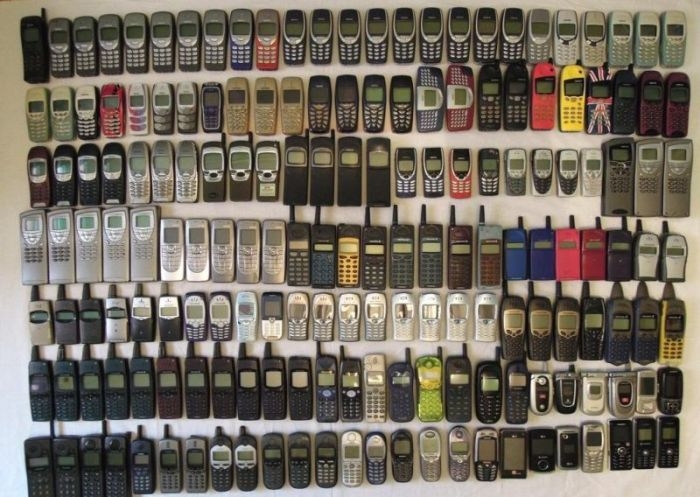
Identify the location of canvas. This screenshot has height=497, width=700. (502, 201).